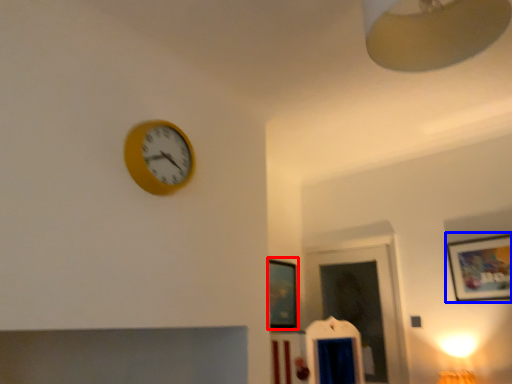
Question: Which of the following is the farthest to the observer, picture frame (highlighted by a red box) or picture frame (highlighted by a blue box)?

Choices:
 (A) picture frame
 (B) picture frame

Answer: (A)